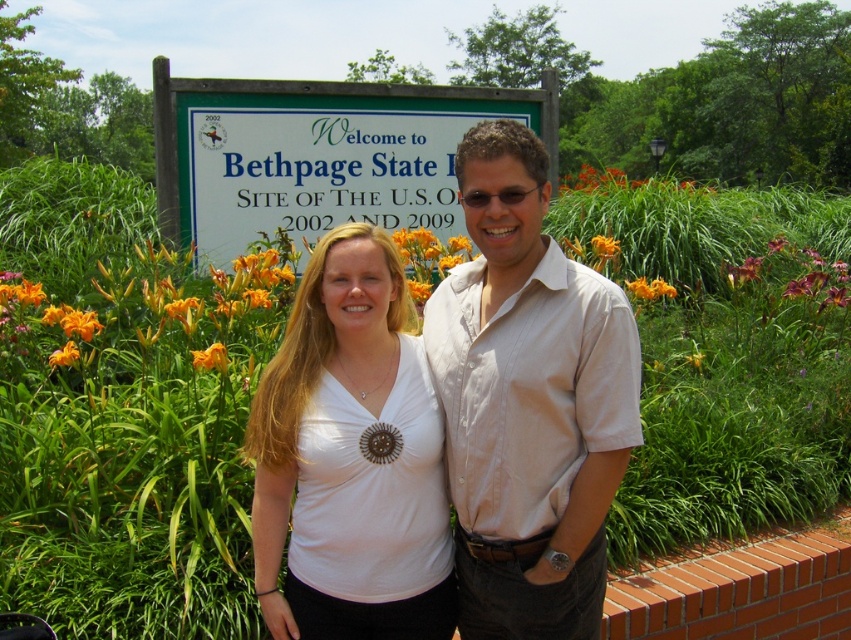
You are a photographer holding a camera. You want to capture a photo of the orange petal at center without moving the camera. Can you do it?

The orange petal at center and camera are 4.88 meters apart, so yes, the photographer can capture the orange petal at center in the photo without moving the camera since the distance is within a typical camera range.